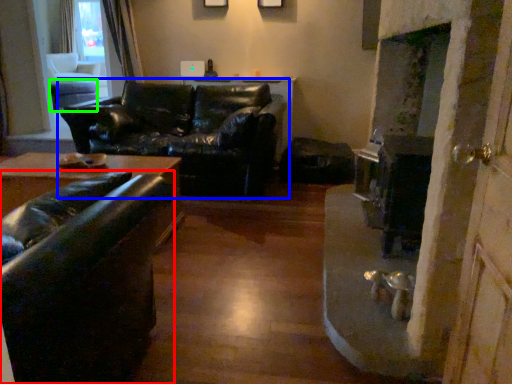
Question: Which object is positioned closest to studio couch (highlighted by a red box)? Select from studio couch (highlighted by a blue box) and table (highlighted by a green box).

Choices:
 (A) studio couch
 (B) table

Answer: (A)